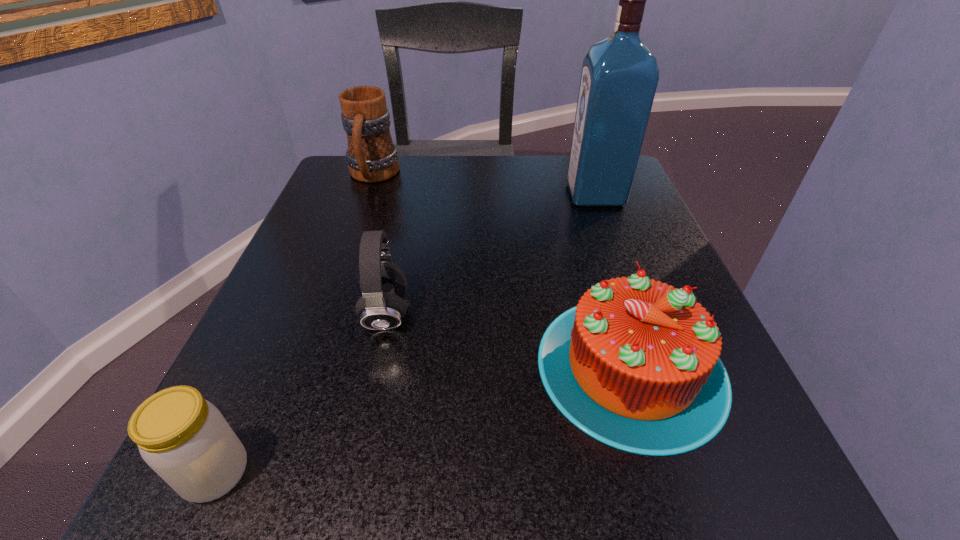
The height and width of the screenshot is (540, 960). What are the coordinates of `cake that is at the right edge` in the screenshot? It's located at [635, 365].

Image resolution: width=960 pixels, height=540 pixels. I want to click on object at the far left corner, so click(371, 156).

The width and height of the screenshot is (960, 540). In order to click on object that is at the near left corner in this screenshot , I will do `click(184, 438)`.

Locate an element on the screen. The height and width of the screenshot is (540, 960). object situated at the far right corner is located at coordinates (619, 78).

The image size is (960, 540). In order to click on object that is at the near right corner in this screenshot , I will do `click(635, 365)`.

The image size is (960, 540). What are the coordinates of `free spot at the far edge of the desktop` in the screenshot? It's located at (509, 188).

The height and width of the screenshot is (540, 960). In the image, there is a desktop. Find the location of `free space at the near edge`. free space at the near edge is located at coordinates (593, 449).

In the image, there is a desktop. Where is `free space at the left edge`? The height and width of the screenshot is (540, 960). free space at the left edge is located at coordinates (323, 426).

The width and height of the screenshot is (960, 540). In the image, there is a desktop. In order to click on free space at the right edge in this screenshot , I will do click(663, 265).

Identify the location of free space at the far left corner. The width and height of the screenshot is (960, 540). (364, 189).